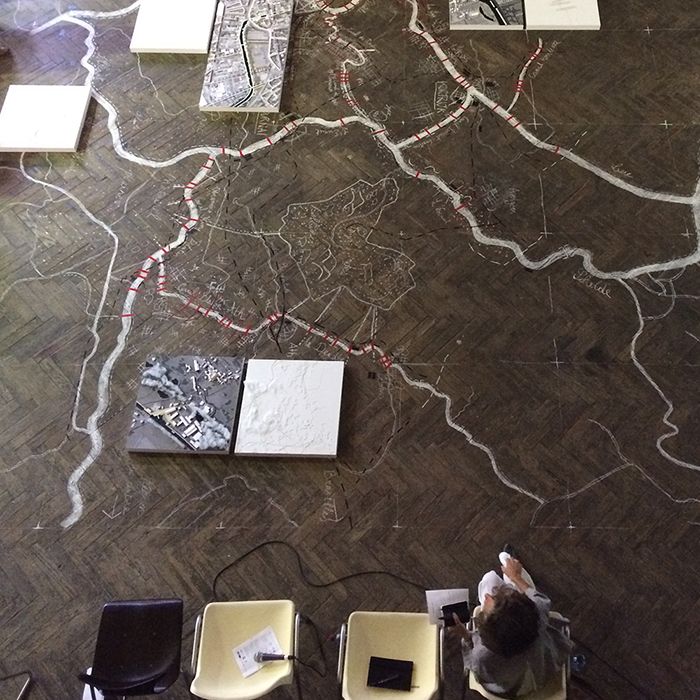
Image resolution: width=700 pixels, height=700 pixels. Identify the location of yellow chair. (238, 619), (367, 626), (477, 690).